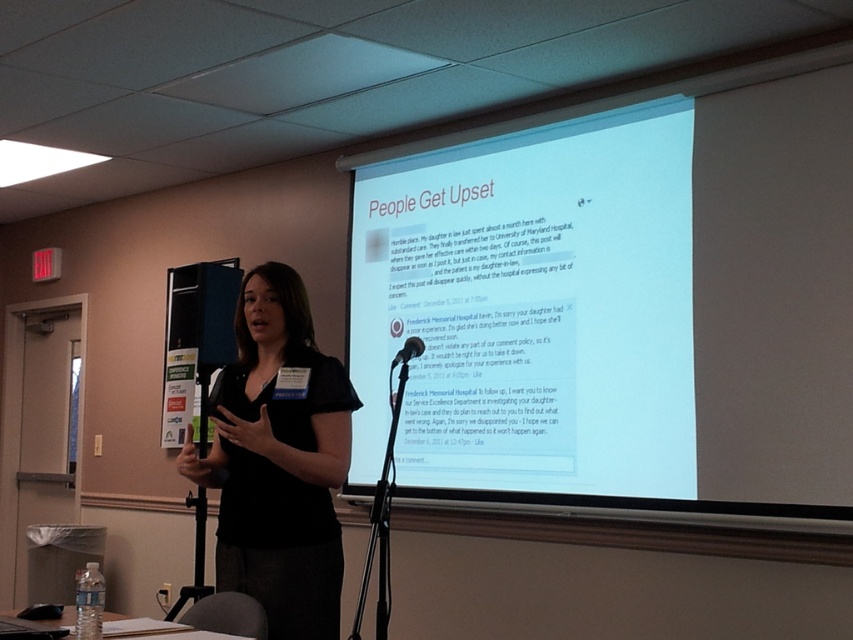
From the picture: Who is positioned more to the left, white matte projector screen at upper center or black matte microphone at center?

black matte microphone at center is more to the left.

Is white matte projector screen at upper center taller than black matte microphone at center?

Yes, white matte projector screen at upper center is taller than black matte microphone at center.

This screenshot has height=640, width=853. What do you see at coordinates (531, 308) in the screenshot?
I see `white matte projector screen at upper center` at bounding box center [531, 308].

Where is `white matte projector screen at upper center`? The width and height of the screenshot is (853, 640). white matte projector screen at upper center is located at coordinates (531, 308).

Is white matte projector screen at upper center further to camera compared to black matte shirt at center?

Yes, it is.

Is point (422, 173) positioned before point (225, 396)?

No, it is behind (225, 396).

The width and height of the screenshot is (853, 640). Find the location of `white matte projector screen at upper center`. white matte projector screen at upper center is located at coordinates (531, 308).

Can you confirm if black matte shirt at center is positioned to the right of black matte microphone at center?

In fact, black matte shirt at center is to the left of black matte microphone at center.

Measure the distance between black matte shirt at center and camera.

A distance of 2.39 meters exists between black matte shirt at center and camera.

Identify the location of black matte shirt at center. (277, 460).